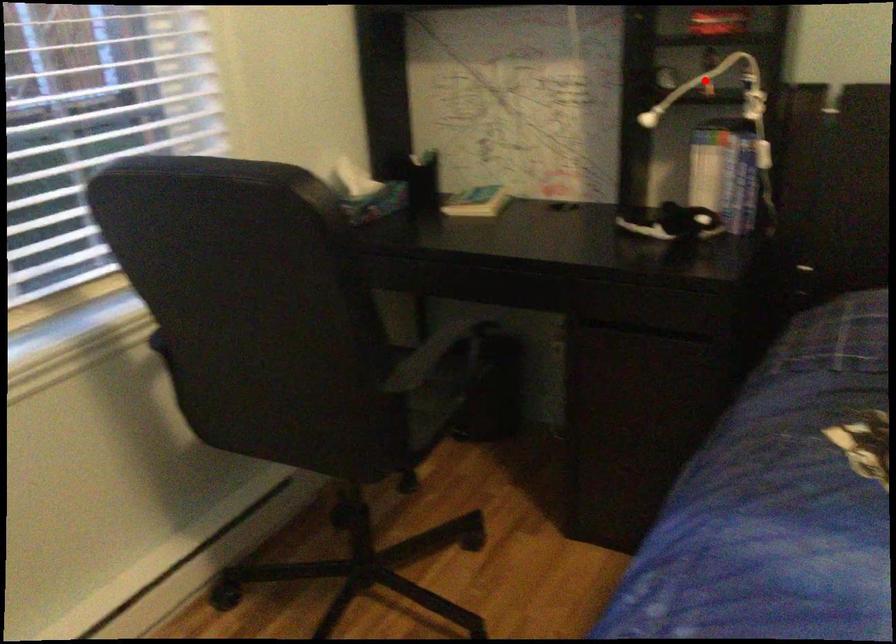
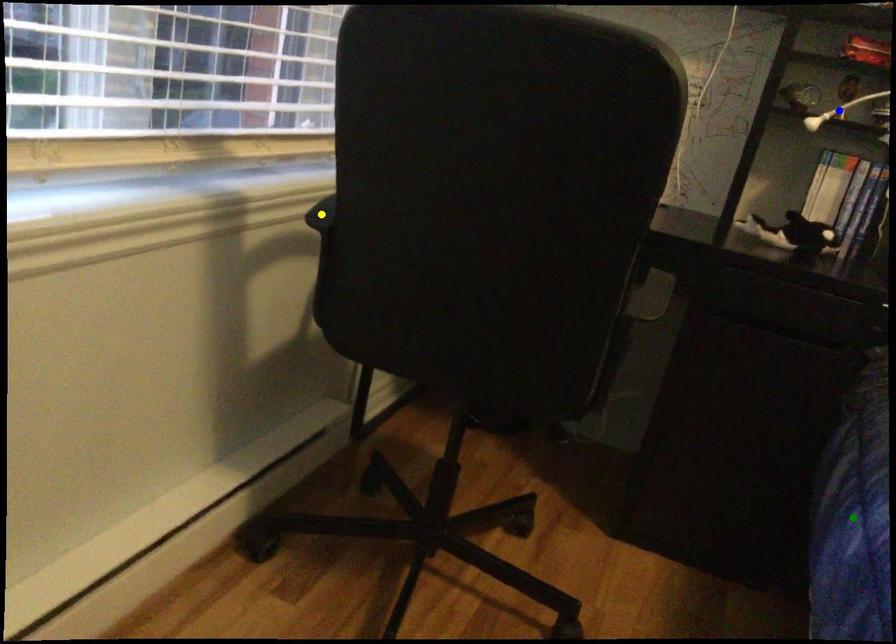
Question: I am providing you with two images of the same scene from different viewpoints. A red point is marked on the first image. You are given multiple points on the second image. In image 2, which mark is for the same physical point as the one in image 1?

Choices:
 (A) blue point
 (B) yellow point
 (C) green point

Answer: (A)